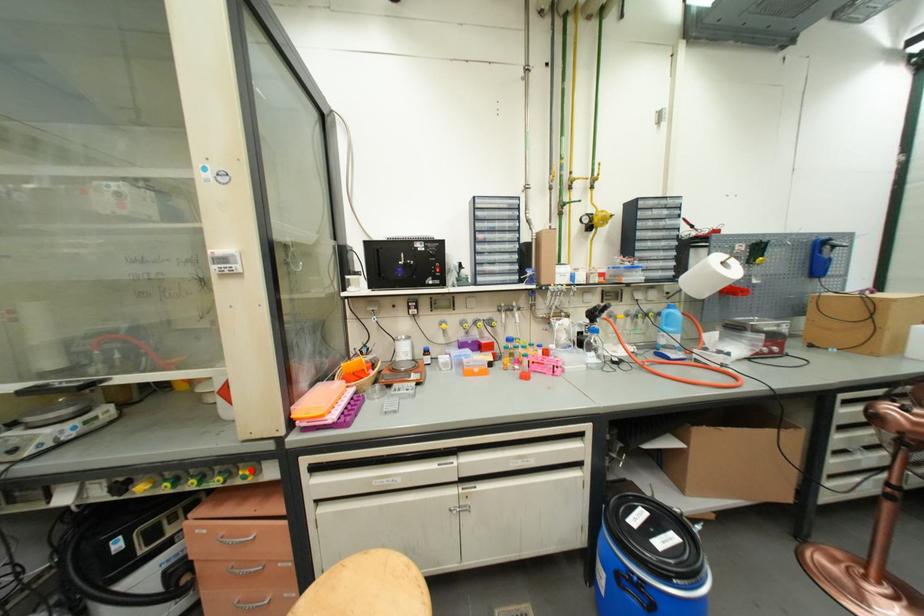
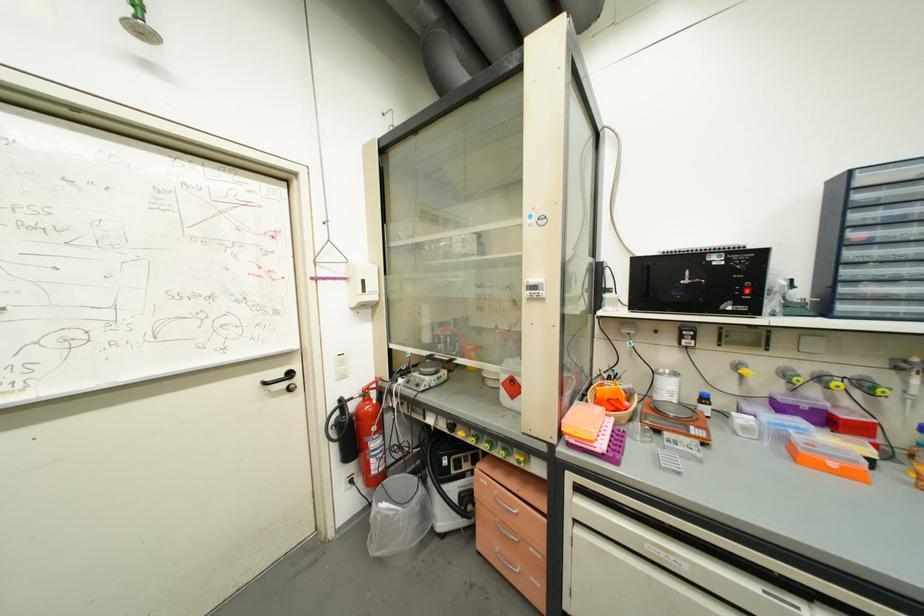
Question: A red point is marked in image1. In image2, is the corresponding 3D point closer to the camera or farther? Reply with the corresponding letter.

Choices:
 (A) The corresponding 3D point is closer.
 (B) The corresponding 3D point is farther.

Answer: (B)